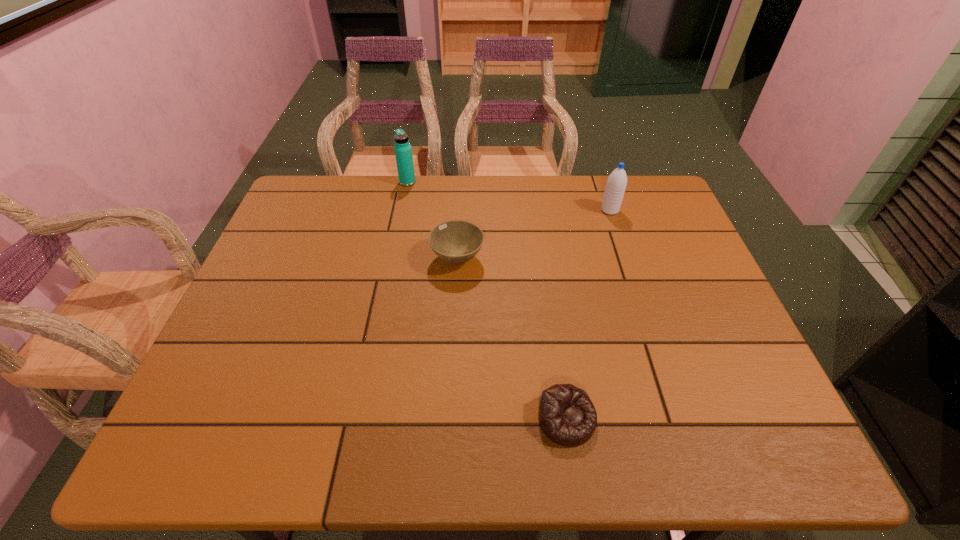
Select which object appears as the third closest to the second farthest object. Please provide its 2D coordinates. Your answer should be formatted as a tuple, i.e. [(x, y)], where the tuple contains the x and y coordinates of a point satisfying the conditions above.

[(567, 416)]

Where is `vacant area in the image that satisfies the following two spatial constraints: 1. on the back side of the second farthest object; 2. on the left side of the third object from right to left`? vacant area in the image that satisfies the following two spatial constraints: 1. on the back side of the second farthest object; 2. on the left side of the third object from right to left is located at coordinates (460, 210).

Where is `free space that satisfies the following two spatial constraints: 1. on the front side of the farther water bottle; 2. on the right side of the rightmost object`? Image resolution: width=960 pixels, height=540 pixels. free space that satisfies the following two spatial constraints: 1. on the front side of the farther water bottle; 2. on the right side of the rightmost object is located at coordinates (402, 210).

Where is `free point that satisfies the following two spatial constraints: 1. on the front side of the third object from left to right; 2. on the right side of the bowl`? This screenshot has width=960, height=540. free point that satisfies the following two spatial constraints: 1. on the front side of the third object from left to right; 2. on the right side of the bowl is located at coordinates (449, 419).